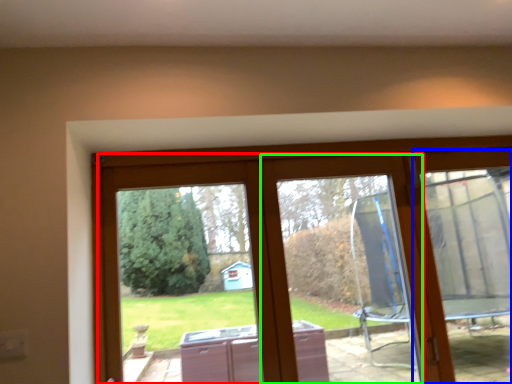
Question: Considering the real-world distances, which object is farthest from glass door (highlighted by a red box)? screen door (highlighted by a blue box) or window frame (highlighted by a green box)?

Choices:
 (A) screen door
 (B) window frame

Answer: (A)